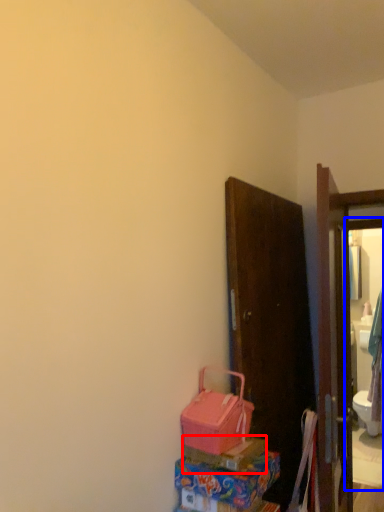
Question: Which of the following is the farthest to the observer, box (highlighted by a red box) or mirror (highlighted by a blue box)?

Choices:
 (A) box
 (B) mirror

Answer: (B)